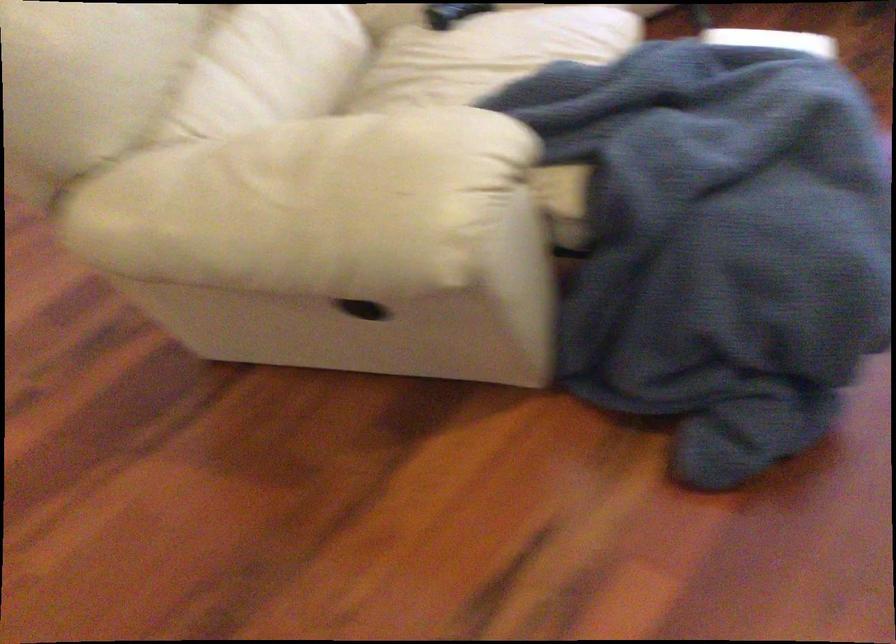
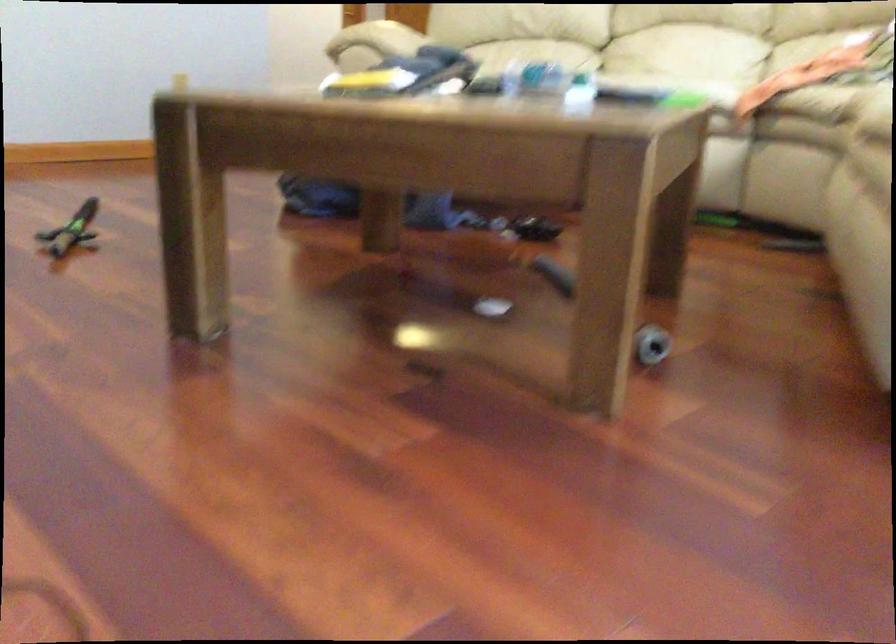
In the second image, find the point that corresponds to pixel 474 176 in the first image.

(371, 44)